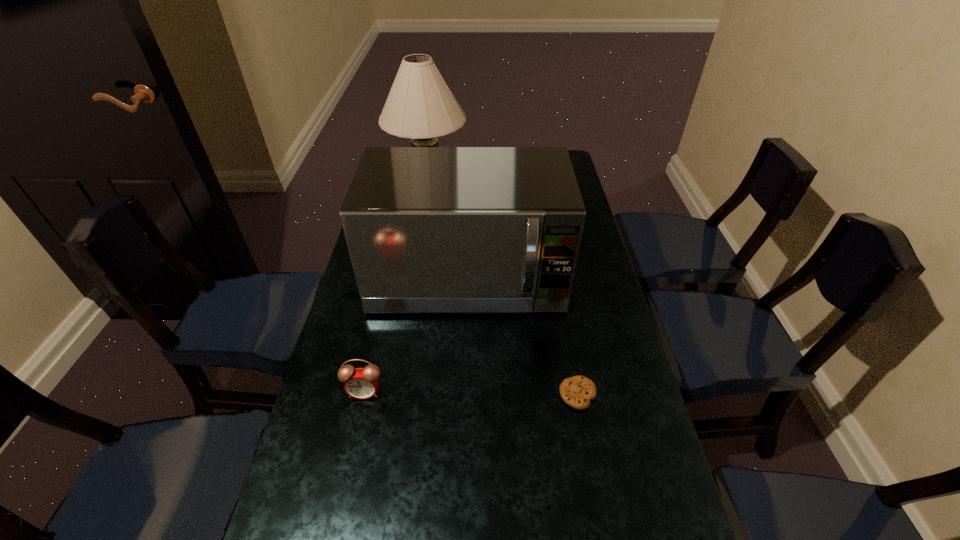
Locate an element on the screen. the tallest object is located at coordinates (420, 105).

Locate an element on the screen. Image resolution: width=960 pixels, height=540 pixels. the farthest object is located at coordinates (420, 105).

The height and width of the screenshot is (540, 960). In order to click on the second tallest object in this screenshot , I will do `click(429, 229)`.

Locate an element on the screen. The width and height of the screenshot is (960, 540). microwave oven is located at coordinates (429, 229).

Identify the location of the third tallest object. The image size is (960, 540). (361, 383).

Identify the location of cookie. The width and height of the screenshot is (960, 540). (577, 391).

Find the location of a particular element. vacant space located on the front of the lampshade is located at coordinates (415, 282).

Identify the location of free region located 0.350m with the door open on the microwave oven. (462, 450).

Identify the location of vacant space situated on the clock face of the third tallest object. This screenshot has width=960, height=540. (353, 442).

Where is `vacant space located on the front of the cookie`? Image resolution: width=960 pixels, height=540 pixels. vacant space located on the front of the cookie is located at coordinates (598, 505).